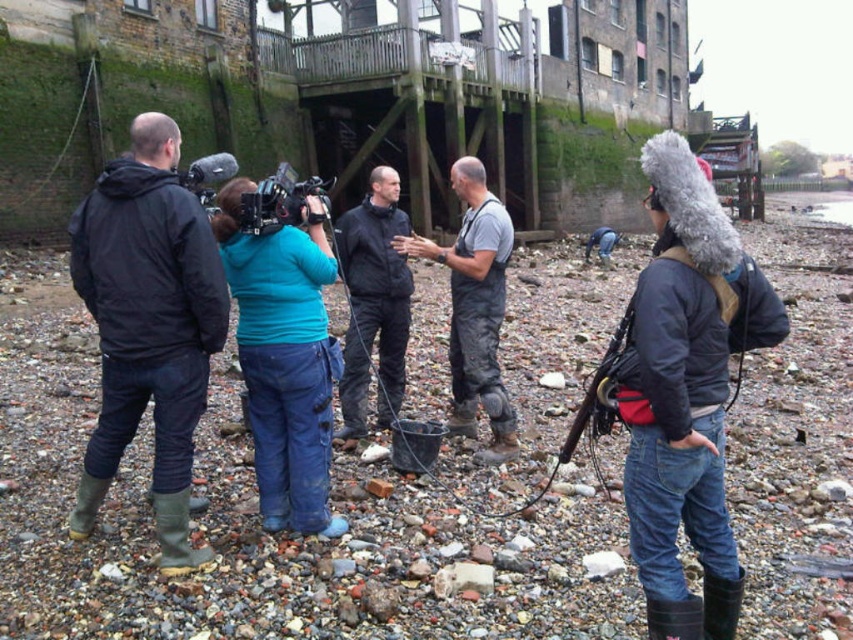
Question: Does camouflage-patterned waders at center have a greater width compared to matte black jacket at center?

Choices:
 (A) no
 (B) yes

Answer: (A)

Question: Is black plastic video camera at center further to the viewer compared to matte black video camera at center?

Choices:
 (A) no
 (B) yes

Answer: (B)

Question: Does black plastic video camera at center appear under matte black video camera at center?

Choices:
 (A) yes
 (B) no

Answer: (B)

Question: Which point is closer to the camera?

Choices:
 (A) (312, 392)
 (B) (218, 179)
 (C) (381, 369)
 (D) (820, 461)

Answer: (A)

Question: Which is nearer to the teal fabric jacket at center?

Choices:
 (A) matte black jacket at center
 (B) dark blue jeans at center
 (C) camouflage-patterned waders at center
 (D) matte black video camera at center

Answer: (B)

Question: Which object is farther from the camera taking this photo?

Choices:
 (A) matte black jacket at center
 (B) dark blue jeans at center

Answer: (A)